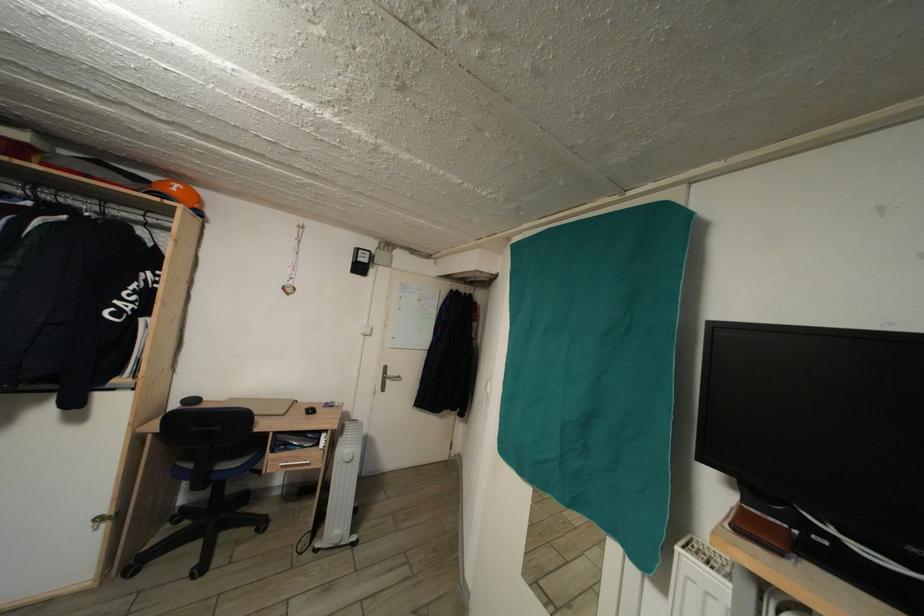
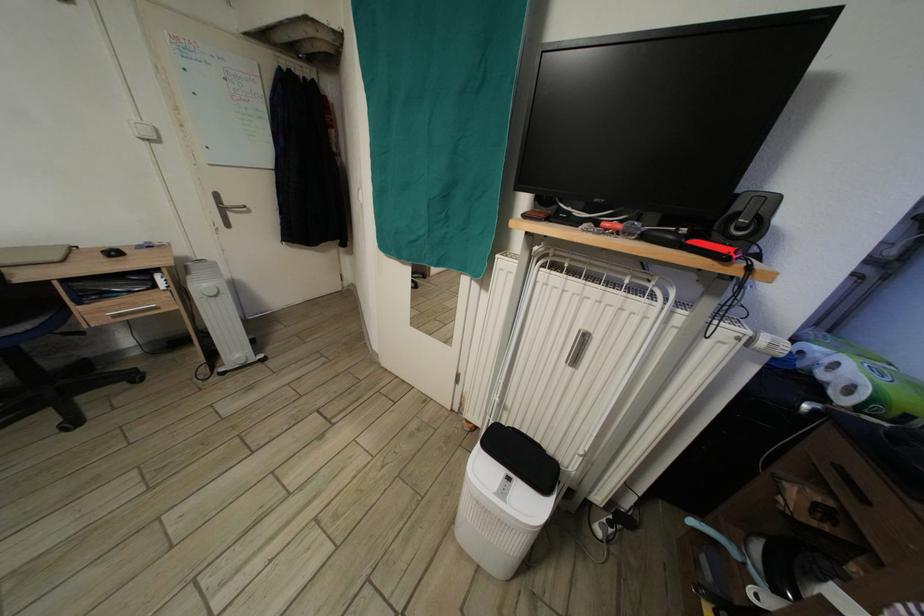
The point at (371, 330) is marked in the first image. Where is the corresponding point in the second image?

(141, 124)